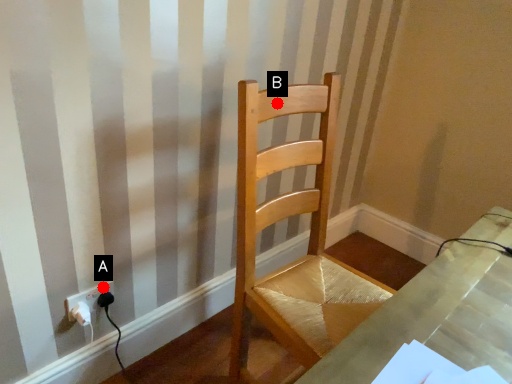
Question: Two points are circled on the image, labeled by A and B beside each circle. Which point appears farthest from the camera in this image?

Choices:
 (A) A is further
 (B) B is further

Answer: (A)